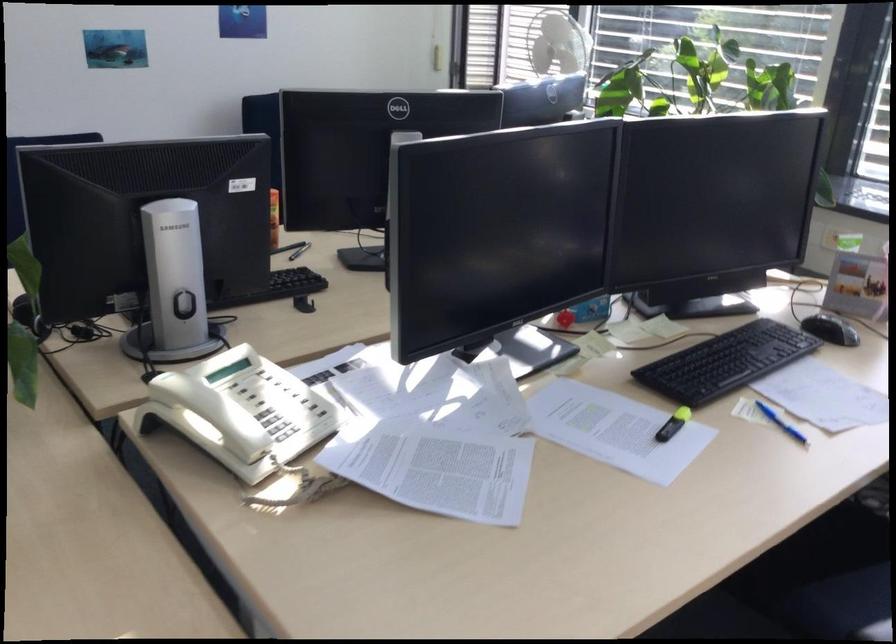
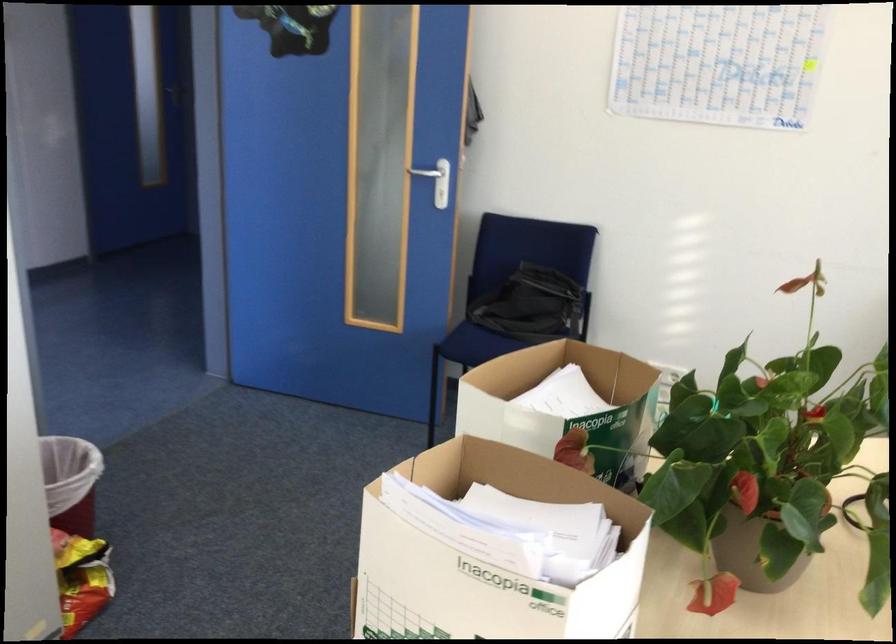
Question: The images are taken continuously from a first-person perspective. In which direction is your viewpoint rotating?

Choices:
 (A) Left
 (B) Right
 (C) Up
 (D) Down

Answer: (A)